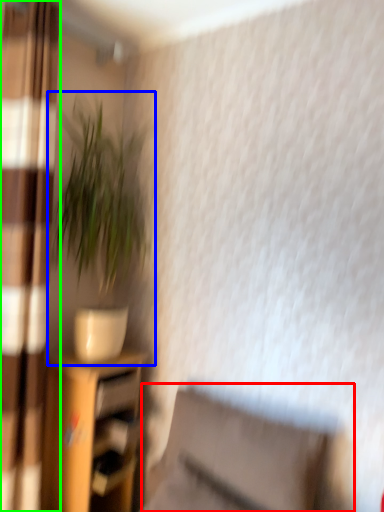
Question: Which is farther away from swivel chair (highlighted by a red box)? houseplant (highlighted by a blue box) or curtain (highlighted by a green box)?

Choices:
 (A) houseplant
 (B) curtain

Answer: (A)